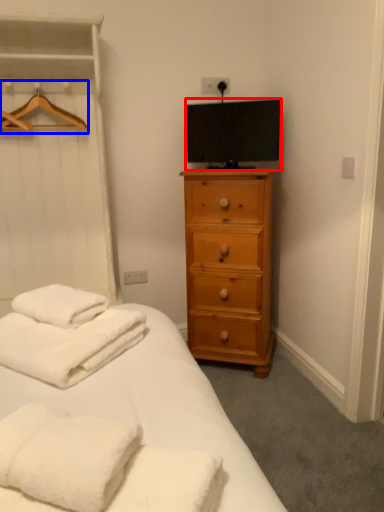
Question: Which object is closer to the camera taking this photo, television (highlighted by a red box) or hanger (highlighted by a blue box)?

Choices:
 (A) television
 (B) hanger

Answer: (B)